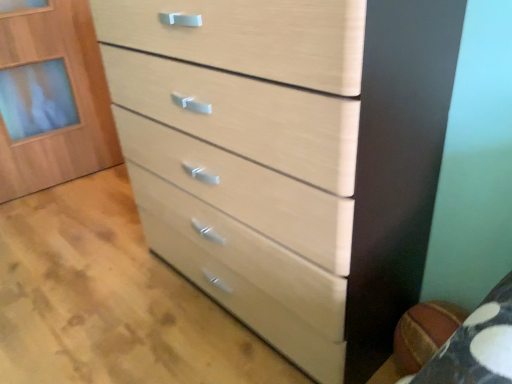
You are a GUI agent. You are given a task and a screenshot of the screen. Output one action in this format:
    pyautogui.click(x=<x>, y=<y>)
    Task: Click on the free location to the right of light wood cabinet at upper left
    The image size is (512, 384).
    Given the screenshot: What is the action you would take?
    pyautogui.click(x=100, y=184)